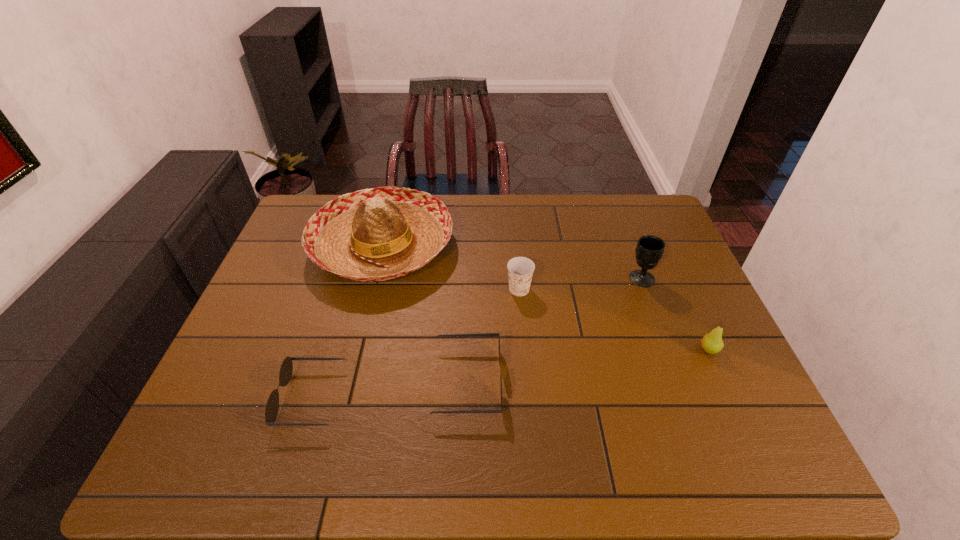
I want to click on free space for a new sunglasses on the right, so click(613, 364).